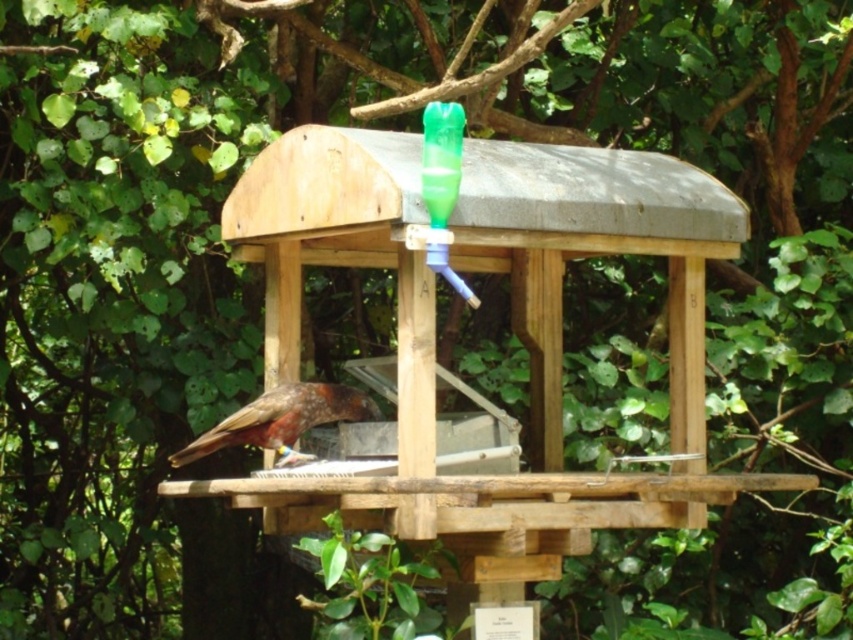
Question: Is brown speckled feathers at center above green translucent bottle at upper center?

Choices:
 (A) yes
 (B) no

Answer: (B)

Question: Can you confirm if brown speckled feathers at center is positioned above green translucent bottle at upper center?

Choices:
 (A) yes
 (B) no

Answer: (B)

Question: Does brown speckled feathers at center appear on the left side of green translucent bottle at upper center?

Choices:
 (A) yes
 (B) no

Answer: (A)

Question: Among these objects, which one is nearest to the camera?

Choices:
 (A) brown speckled feathers at center
 (B) green translucent bottle at upper center

Answer: (B)

Question: Which of the following is the closest to the observer?

Choices:
 (A) (437, 163)
 (B) (286, 461)

Answer: (A)